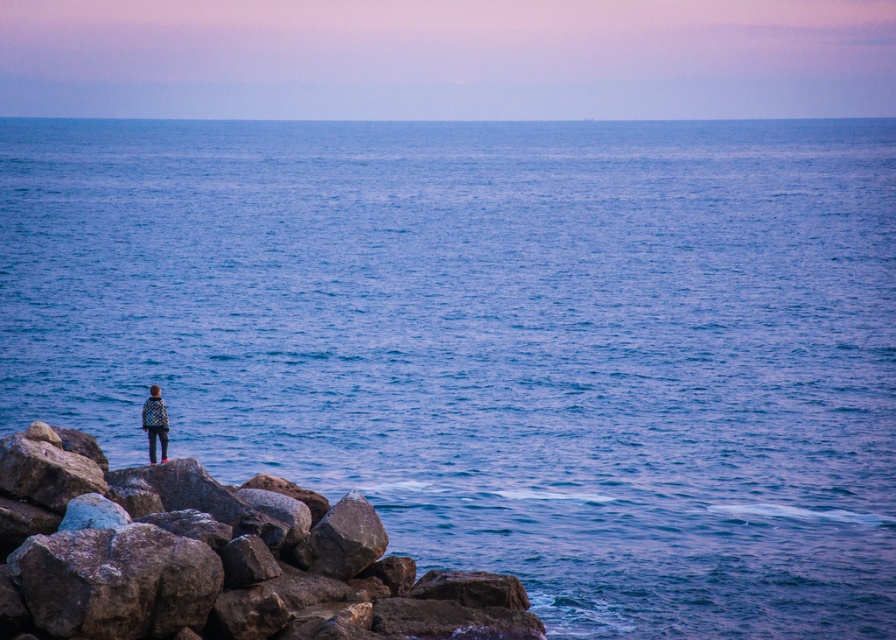
You are standing on the rocky shoreline and see the rough textured rock at lower left and the checkered fabric jacket at lower left. Which object is closer to your feet?

The rough textured rock at lower left is closer to your feet because it is positioned under the checkered fabric jacket at lower left, indicating it is lower in elevation.

You are standing on the rocky shoreline and see the rough textured rock at lower left and the checkered fabric jacket at lower left. Which object is positioned further to the left?

The checkered fabric jacket at lower left is positioned further to the left compared to the rough textured rock at lower left, as the rock is located to the right of the jacket.

You are standing at the center of the image. Which direction should you move to reach the rough textured rock at lower left?

You should move to the left and downward direction to reach the rough textured rock at lower left because it is located at point (214, 560) which is lower left position in the image.